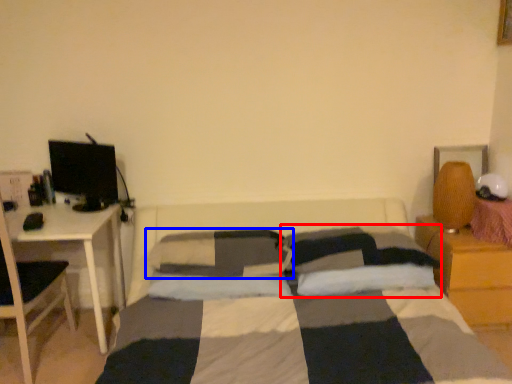
Question: Among these objects, which one is farthest to the camera, pillow (highlighted by a red box) or pillow (highlighted by a blue box)?

Choices:
 (A) pillow
 (B) pillow

Answer: (B)